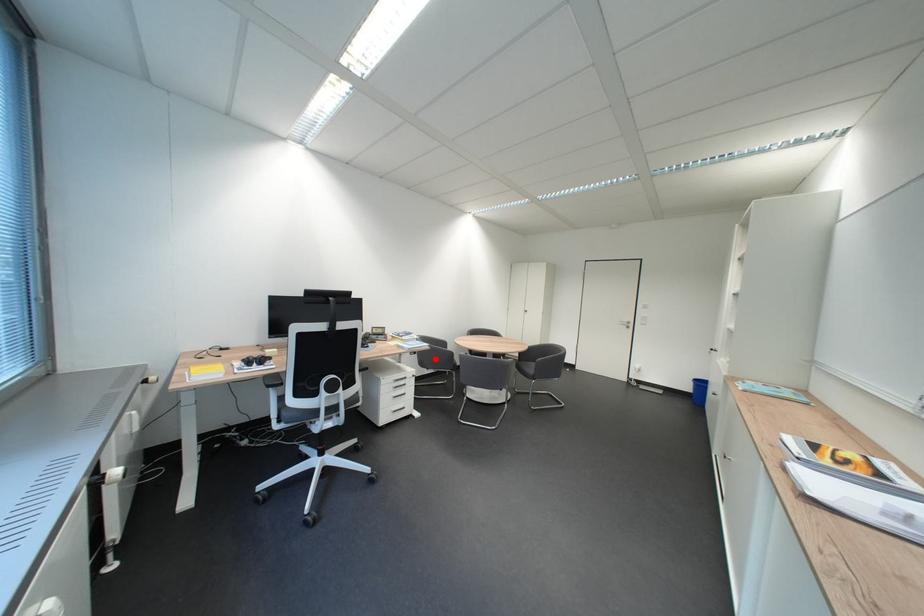
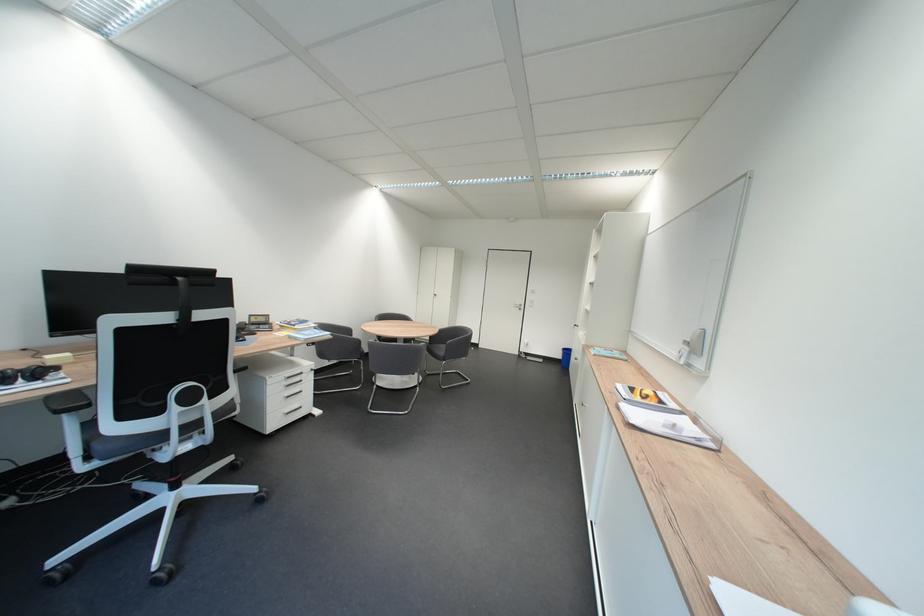
The point at the highlighted location is marked in the first image. Where is the corresponding point in the second image?

(334, 350)